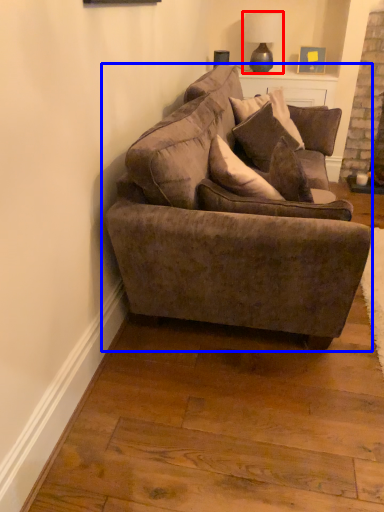
Question: Which point is further to the camera, lamp (highlighted by a red box) or studio couch (highlighted by a blue box)?

Choices:
 (A) lamp
 (B) studio couch

Answer: (A)